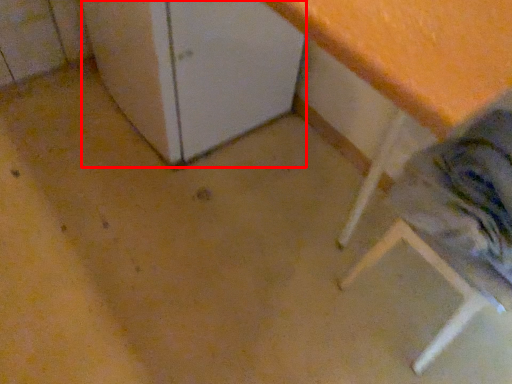
Question: From the image's perspective, what is the correct spatial positioning of leftover (annotated by the red box) in reference to step stool?

Choices:
 (A) above
 (B) below

Answer: (A)